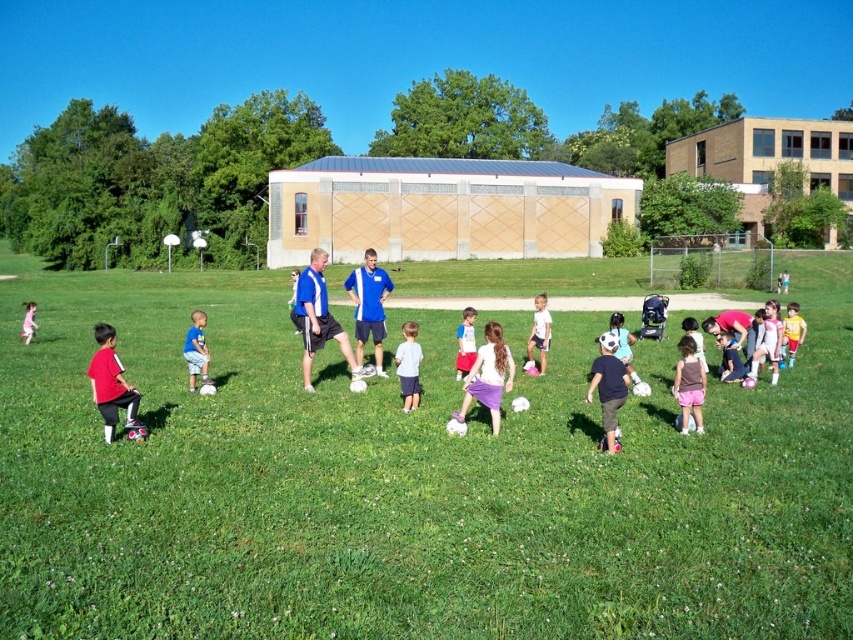
Question: Which of the following is the closest to the observer?

Choices:
 (A) (683, 413)
 (B) (546, 310)
 (C) (607, 392)

Answer: (C)

Question: Which of the following is the farthest from the observer?

Choices:
 (A) (192, 378)
 (B) (103, 360)
 (C) (619, 403)

Answer: (A)

Question: Can you confirm if matte red shirt at lower left is positioned to the left of matte black soccer ball at center?

Choices:
 (A) yes
 (B) no

Answer: (A)

Question: Is white matte shirt at center to the left of white cotton shirt at center from the viewer's perspective?

Choices:
 (A) yes
 (B) no

Answer: (A)

Question: Which of the following is the closest to the observer?

Choices:
 (A) (608, 428)
 (B) (103, 339)
 (C) (190, 387)
 (D) (410, 340)

Answer: (A)

Question: Is matte red shirt at lower left positioned before purple satin skirt at center?

Choices:
 (A) no
 (B) yes

Answer: (B)